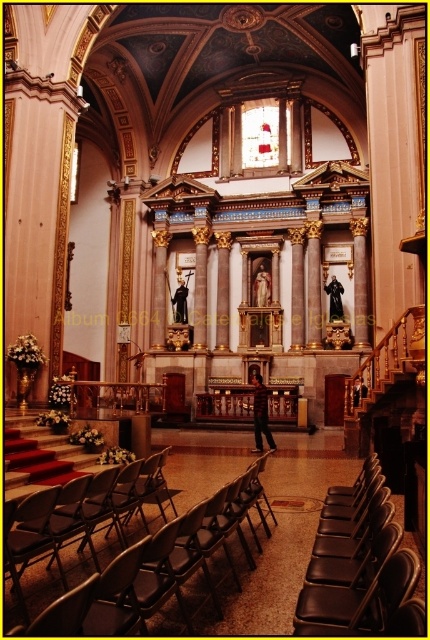
Question: Which is nearer to the black leather chairs at lower right?

Choices:
 (A) black leather chair at lower center
 (B) metallic silver chair at center

Answer: (A)

Question: Which point appears farthest from the camera in this image?

Choices:
 (A) (33, 580)
 (B) (267, 442)
 (C) (331, 595)
 (D) (344, 602)

Answer: (B)

Question: Which object appears farthest from the camera in this image?

Choices:
 (A) black leather chair at lower center
 (B) metallic silver chair at center
 (C) dark brown leather jacket at center

Answer: (C)

Question: From the image, what is the correct spatial relationship of black leather chairs at lower right in relation to black leather chair at lower center?

Choices:
 (A) left
 (B) right

Answer: (B)

Question: Is dark brown leather jacket at center behind black statue at center?

Choices:
 (A) no
 (B) yes

Answer: (A)

Question: In this image, where is metallic silver chair at center located relative to black leather chair at lower center?

Choices:
 (A) right
 (B) left

Answer: (B)